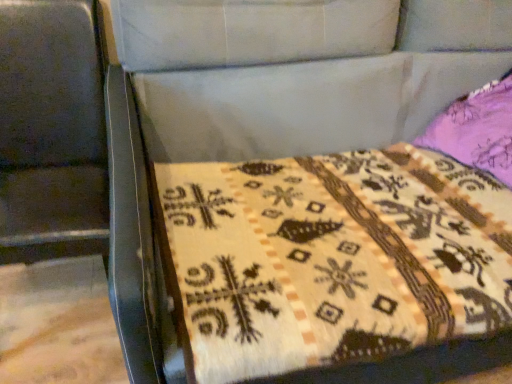
Question: Is metallic swivel chair at left inside or outside of beige woven quilt at center?

Choices:
 (A) outside
 (B) inside

Answer: (A)

Question: In terms of size, does metallic swivel chair at left appear bigger or smaller than beige woven quilt at center?

Choices:
 (A) small
 (B) big

Answer: (B)

Question: From the image's perspective, is metallic swivel chair at left above or below beige woven quilt at center?

Choices:
 (A) above
 (B) below

Answer: (A)

Question: Based on their positions, is beige woven quilt at center located to the left or right of metallic swivel chair at left?

Choices:
 (A) right
 (B) left

Answer: (A)

Question: From the image's perspective, is beige woven quilt at center above or below metallic swivel chair at left?

Choices:
 (A) above
 (B) below

Answer: (B)

Question: Is beige woven quilt at center bigger or smaller than metallic swivel chair at left?

Choices:
 (A) small
 (B) big

Answer: (A)

Question: Is point (250, 208) closer or farther from the camera than point (37, 6)?

Choices:
 (A) closer
 (B) farther

Answer: (A)